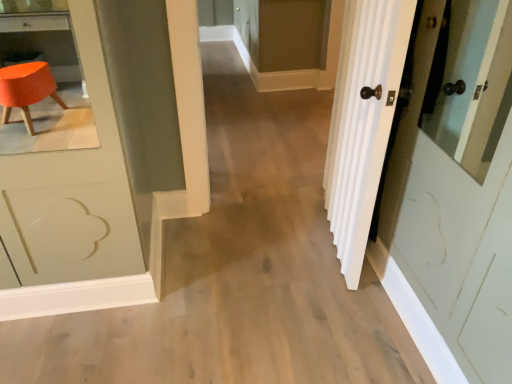
Question: Should I look upward or downward to see matte brown screen door at upper center?

Choices:
 (A) up
 (B) down

Answer: (A)

Question: Is matte brown screen door at upper center bigger than white wood door at right?

Choices:
 (A) yes
 (B) no

Answer: (A)

Question: Is the position of matte brown screen door at upper center less distant than that of white wood door at right?

Choices:
 (A) no
 (B) yes

Answer: (A)

Question: Is white wood door at right surrounded by matte brown screen door at upper center?

Choices:
 (A) yes
 (B) no

Answer: (B)

Question: Can you confirm if matte brown screen door at upper center is thinner than white wood door at right?

Choices:
 (A) yes
 (B) no

Answer: (B)

Question: Is matte brown screen door at upper center turned away from white wood door at right?

Choices:
 (A) no
 (B) yes

Answer: (A)

Question: Can you confirm if matte brown screen door at upper center is positioned to the left of white wood door at right?

Choices:
 (A) no
 (B) yes

Answer: (B)

Question: From the image's perspective, does white wood door at right appear lower than matte brown screen door at upper center?

Choices:
 (A) yes
 (B) no

Answer: (A)

Question: Can you see white wood door at right touching matte brown screen door at upper center?

Choices:
 (A) no
 (B) yes

Answer: (A)

Question: Is matte brown screen door at upper center at the back of white wood door at right?

Choices:
 (A) no
 (B) yes

Answer: (A)

Question: Does white wood door at right lie behind matte brown screen door at upper center?

Choices:
 (A) no
 (B) yes

Answer: (A)

Question: Could you tell me if white wood door at right is turned towards matte brown screen door at upper center?

Choices:
 (A) no
 (B) yes

Answer: (A)

Question: Is white wood door at right thinner than matte brown screen door at upper center?

Choices:
 (A) yes
 (B) no

Answer: (A)

Question: Looking at their shapes, would you say matte brown screen door at upper center is wider or thinner than white wood door at right?

Choices:
 (A) wide
 (B) thin

Answer: (A)